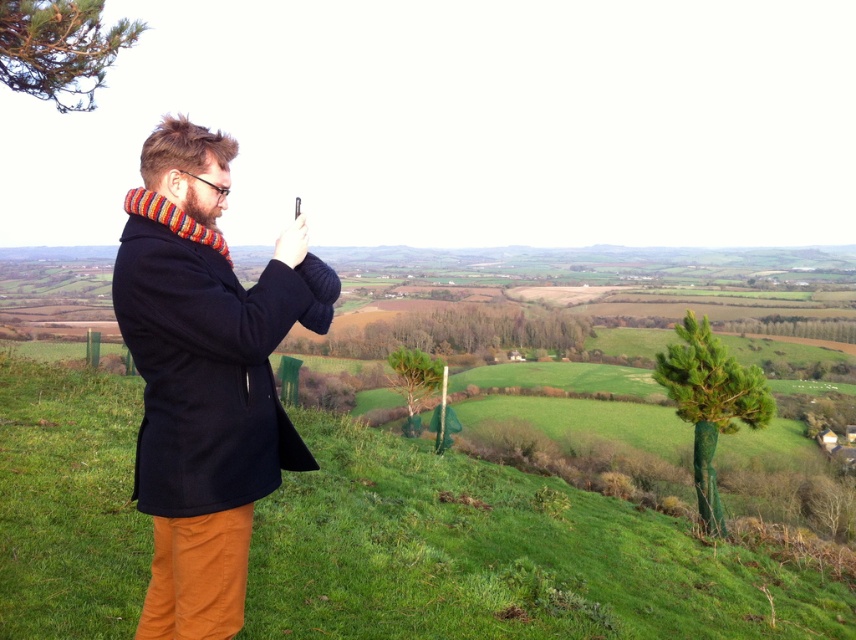
Consider the image. You are a nature photographer wanting to capture the green textured pine at right and the green textured pine at center in your photo. Which pine has a thicker trunk?

The green textured pine at center has a thicker trunk than the green textured pine at right.

You are a photographer trying to capture the dark blue wool coat at center and the green textured pine at right in the same frame. Based on their positions, which object should you focus on first to ensure both are in the shot?

The dark blue wool coat at center is above the green textured pine at right, so you should focus on the green textured pine at right first to ensure both are in the frame.

You are the photographer in the scene and want to focus on the point closer to you. Which point should you choose between point (271, 276) and point (714, 412)?

Point (271, 276) is closer to the camera than point (714, 412), so you should choose point (271, 276) to focus on.